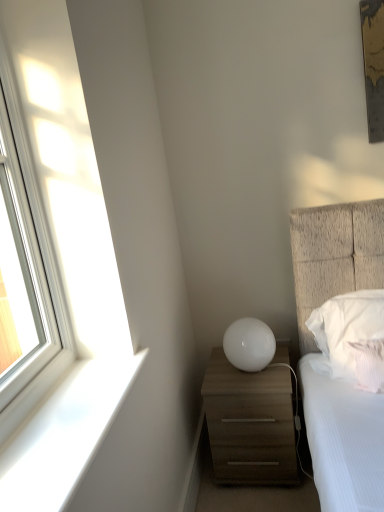
I want to click on free point above matte wood chest of drawers at lower right (from a real-world perspective), so click(243, 375).